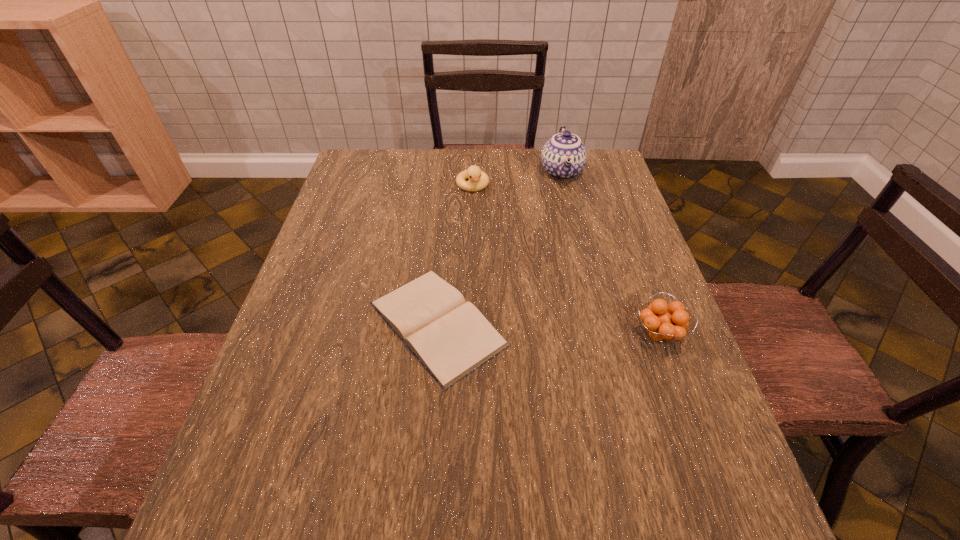
At what (x,y) coordinates should I click in order to perform the action: click on vacant space at the right edge of the desktop. Please return your answer as a coordinate pair (x, y). Looking at the image, I should click on (628, 215).

Identify the location of free spot at the far left corner of the desktop. This screenshot has width=960, height=540. (355, 186).

This screenshot has width=960, height=540. In the image, there is a desktop. What are the coordinates of `vacant space at the near left corner` in the screenshot? It's located at [280, 467].

The width and height of the screenshot is (960, 540). Find the location of `vacant space at the far right corner`. vacant space at the far right corner is located at coordinates (595, 164).

What are the coordinates of `empty space that is in between the tallest object and the duckling` in the screenshot? It's located at (517, 179).

Where is `vacant area that lies between the shortest object and the duckling`? The height and width of the screenshot is (540, 960). vacant area that lies between the shortest object and the duckling is located at coordinates (455, 254).

Find the location of a particular element. This screenshot has width=960, height=540. blank region between the shortest object and the tallest object is located at coordinates (499, 248).

I want to click on empty location between the duckling and the orange fruit, so click(x=565, y=260).

Image resolution: width=960 pixels, height=540 pixels. In order to click on free space between the shortest object and the chinaware in this screenshot , I will do click(x=499, y=248).

Find the location of a particular element. The width and height of the screenshot is (960, 540). unoccupied area between the shortest object and the chinaware is located at coordinates (499, 248).